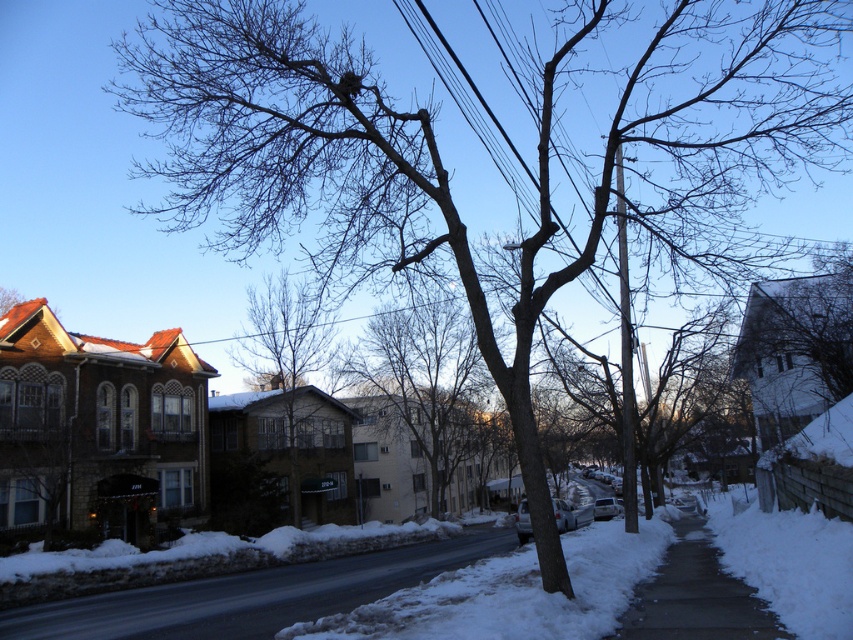
Question: From the image, what is the correct spatial relationship of bare branches at center in relation to brown textured building at center?

Choices:
 (A) above
 (B) below

Answer: (B)

Question: Does black asphalt road at center have a smaller size compared to gray concrete sidewalk at lower right?

Choices:
 (A) yes
 (B) no

Answer: (B)

Question: Which object is the farthest from the brown textured building at center?

Choices:
 (A) black asphalt road at center
 (B) bare branches at center
 (C) gray concrete sidewalk at lower right

Answer: (C)

Question: Is black asphalt road at center to the left of brown textured building at center from the viewer's perspective?

Choices:
 (A) yes
 (B) no

Answer: (B)

Question: Which point is closer to the camera?

Choices:
 (A) black asphalt road at center
 (B) gray concrete sidewalk at lower right
 (C) bare branches at center

Answer: (B)

Question: Which object is positioned farthest from the bare branches at center?

Choices:
 (A) brown textured building at center
 (B) black asphalt road at center

Answer: (B)